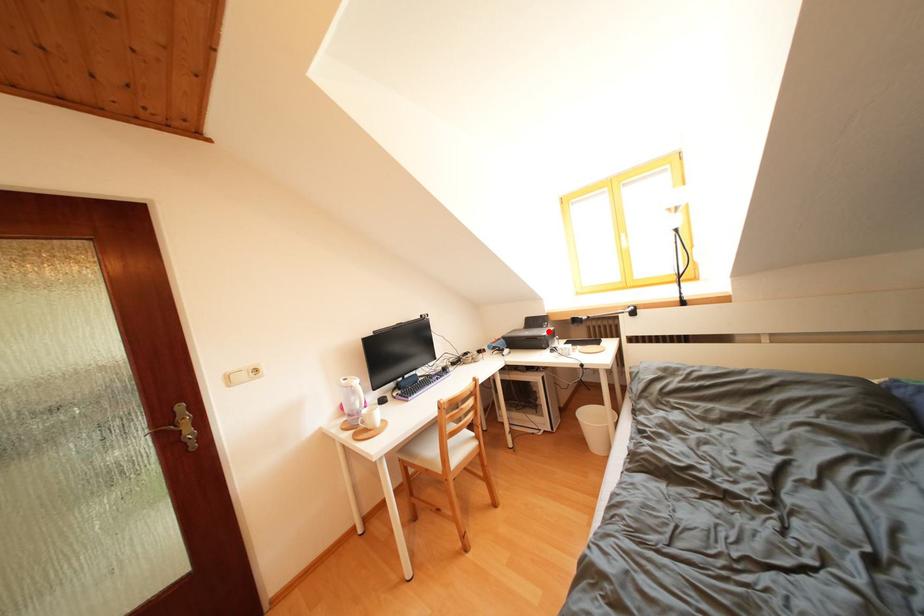
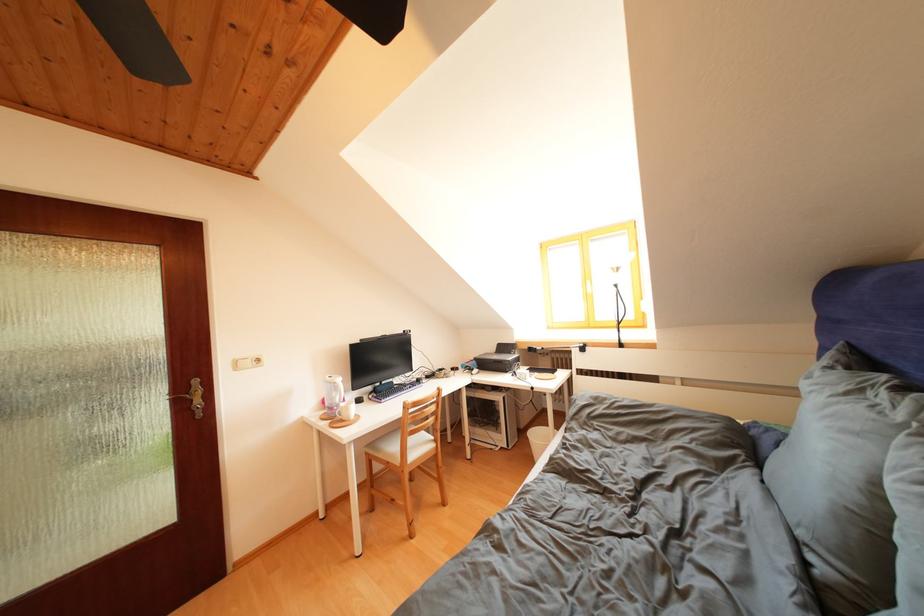
Where in the second image is the point corresponding to the highlighted location from the first image?

(517, 358)